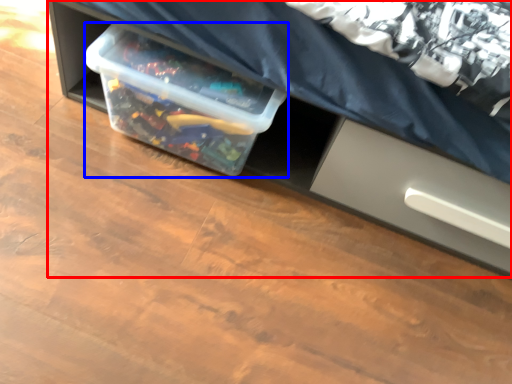
Question: Which of the following is the farthest to the observer, furniture (highlighted by a red box) or box (highlighted by a blue box)?

Choices:
 (A) furniture
 (B) box

Answer: (B)